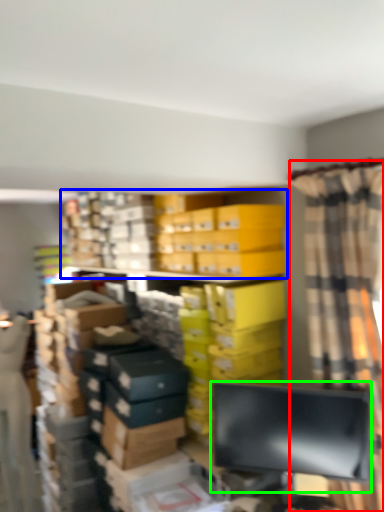
Question: Which object is the closest to the curtain (highlighted by a red box)? Choose among these: bookcase (highlighted by a blue box) or computer monitor (highlighted by a green box).

Choices:
 (A) bookcase
 (B) computer monitor

Answer: (B)